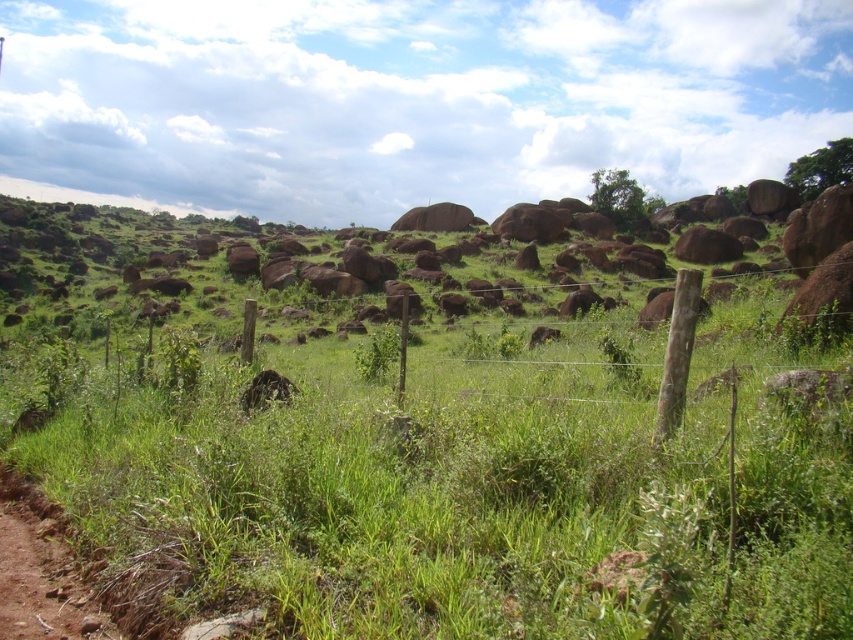
Question: Is green grassy at center thinner than brown fuzzy animal at center?

Choices:
 (A) yes
 (B) no

Answer: (B)

Question: Which point is closer to the camera?

Choices:
 (A) green grassy at center
 (B) brown fuzzy animal at center

Answer: (A)

Question: Which point is closer to the camera?

Choices:
 (A) green grassy at center
 (B) brown fuzzy animal at center

Answer: (A)

Question: Is green grassy at center above brown fuzzy animal at center?

Choices:
 (A) no
 (B) yes

Answer: (B)

Question: Is green grassy at center positioned behind brown fuzzy animal at center?

Choices:
 (A) yes
 (B) no

Answer: (B)